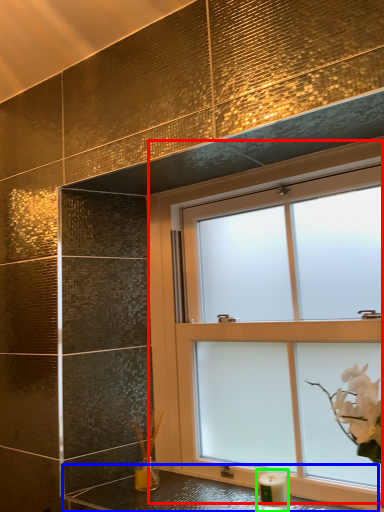
Question: Which is farther away from window (highlighted by a red box)? counter top (highlighted by a blue box) or candle holder (highlighted by a green box)?

Choices:
 (A) counter top
 (B) candle holder

Answer: (B)